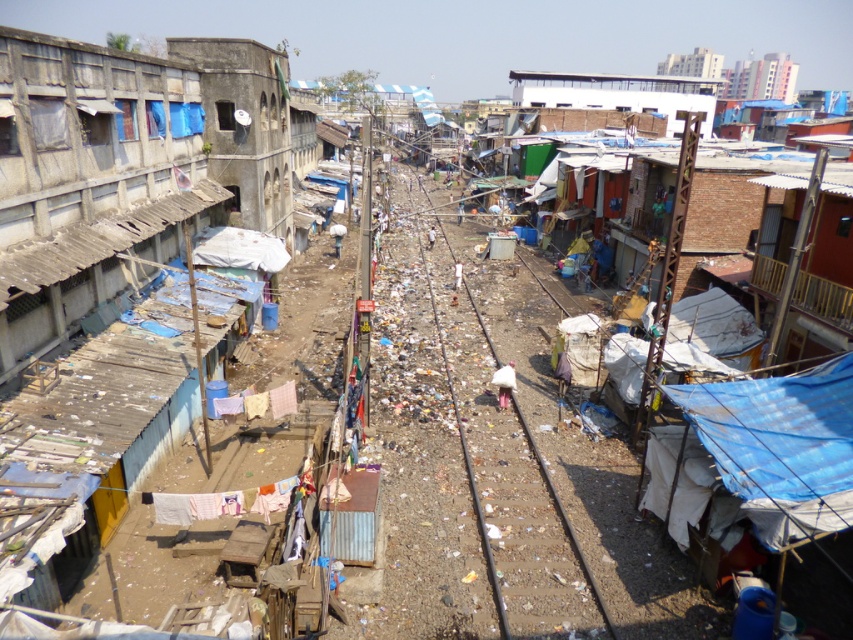
You are a delivery person trying to navigate through the area. You need to move from the rusty corrugated metal hut at left to the smooth metal train track at center. Is the path directly between them elevated or lower than the track?

The rusty corrugated metal hut at left is located above the smooth metal train track at center, so the path between them is elevated compared to the track.

You are standing at the origin point of the image. Where is the rusty corrugated metal hut at left located?

The rusty corrugated metal hut at left is located at point (125, 168).

You are a delivery person trying to navigate through the area between the rusty corrugated metal hut at left and the white corrugated metal hut at upper center. Which direction should you go to avoid the debris on the ground?

The rusty corrugated metal hut at left is positioned on the left side of the white corrugated metal hut at upper center. To avoid debris, you should move towards the white corrugated metal hut at upper center as the debris is likely concentrated near the railway tracks between the two huts.